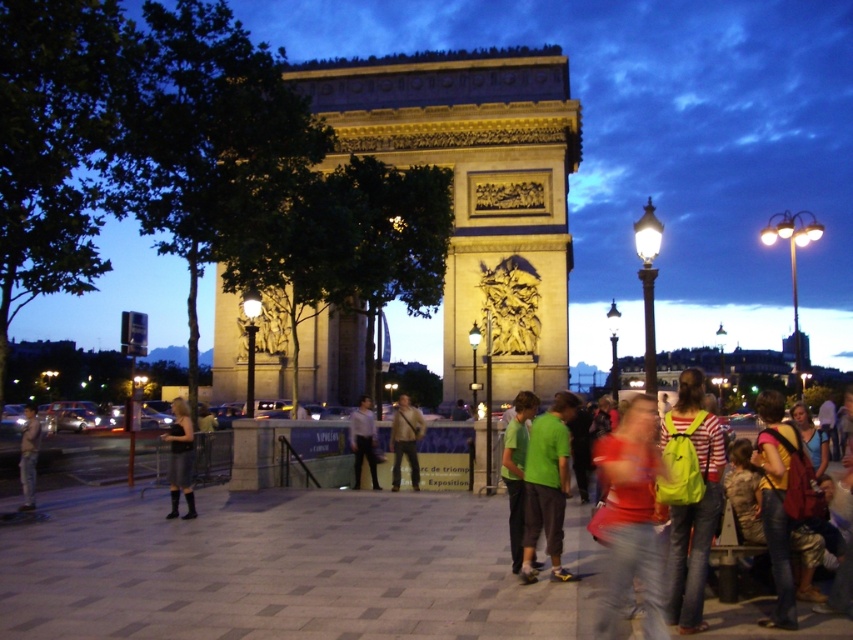
Does point (177, 408) come behind point (416, 433)?

Yes, point (177, 408) is behind point (416, 433).

Who is shorter, matte black boots at lower left or matte brown bag at center?

matte brown bag at center is shorter.

The height and width of the screenshot is (640, 853). What do you see at coordinates (180, 458) in the screenshot?
I see `matte black boots at lower left` at bounding box center [180, 458].

Find the location of a particular element. This screenshot has height=640, width=853. matte black boots at lower left is located at coordinates (180, 458).

Can you confirm if green backpack at center is taller than matte red shirt at center?

Indeed, green backpack at center has a greater height compared to matte red shirt at center.

Is green backpack at center further to the viewer compared to matte red shirt at center?

Yes, green backpack at center is further from the viewer.

Consider the image. Who is more distant from viewer, (775, 412) or (646, 456)?

The point (775, 412) is behind.

Identify the location of green backpack at center. [693, 532].

Is matte red shirt at center to the right of striped cotton shirt at lower right from the viewer's perspective?

No, matte red shirt at center is not to the right of striped cotton shirt at lower right.

The height and width of the screenshot is (640, 853). Describe the element at coordinates (631, 516) in the screenshot. I see `matte red shirt at center` at that location.

You are a GUI agent. You are given a task and a screenshot of the screen. Output one action in this format:
    pyautogui.click(x=<x>, y=<y>)
    Task: Click on the matte red shirt at center
    The width and height of the screenshot is (853, 640).
    Given the screenshot: What is the action you would take?
    pyautogui.click(x=631, y=516)